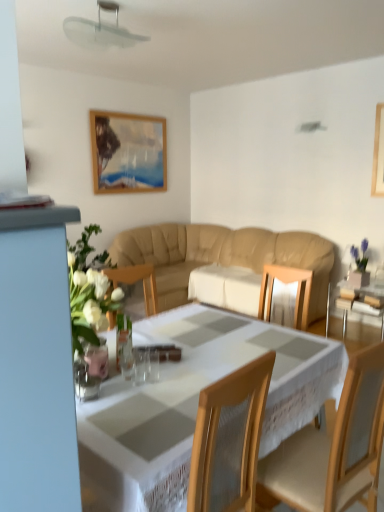
Question: Considering the relative sizes of wooden chair at center and transparent glass table at right in the image provided, is wooden chair at center thinner than transparent glass table at right?

Choices:
 (A) no
 (B) yes

Answer: (B)

Question: Can you confirm if wooden chair at center is smaller than transparent glass table at right?

Choices:
 (A) no
 (B) yes

Answer: (A)

Question: Considering the relative sizes of wooden chair at center and transparent glass table at right in the image provided, is wooden chair at center shorter than transparent glass table at right?

Choices:
 (A) no
 (B) yes

Answer: (A)

Question: Would you consider wooden chair at center to be distant from transparent glass table at right?

Choices:
 (A) yes
 (B) no

Answer: (A)

Question: Does wooden chair at center lie in front of transparent glass table at right?

Choices:
 (A) yes
 (B) no

Answer: (A)

Question: From a real-world perspective, is clear glass vase at lower left physically located above or below transparent plastic fan at upper center?

Choices:
 (A) above
 (B) below

Answer: (B)

Question: From the image's perspective, is clear glass vase at lower left positioned above or below transparent plastic fan at upper center?

Choices:
 (A) below
 (B) above

Answer: (A)

Question: Based on their positions, is clear glass vase at lower left located to the left or right of transparent plastic fan at upper center?

Choices:
 (A) left
 (B) right

Answer: (B)

Question: From their relative heights in the image, would you say clear glass vase at lower left is taller or shorter than transparent plastic fan at upper center?

Choices:
 (A) short
 (B) tall

Answer: (A)

Question: Looking at their shapes, would you say clear glass vase at lower left is wider or thinner than white lace tablecloth at center?

Choices:
 (A) wide
 (B) thin

Answer: (B)

Question: Considering the positions of point (84, 352) and point (109, 459), is point (84, 352) closer or farther from the camera than point (109, 459)?

Choices:
 (A) closer
 (B) farther

Answer: (B)

Question: Based on their positions, is clear glass vase at lower left located to the left or right of white lace tablecloth at center?

Choices:
 (A) right
 (B) left

Answer: (B)

Question: In terms of size, does clear glass vase at lower left appear bigger or smaller than white lace tablecloth at center?

Choices:
 (A) small
 (B) big

Answer: (A)

Question: Considering the positions of point (182, 295) and point (365, 372), is point (182, 295) closer or farther from the camera than point (365, 372)?

Choices:
 (A) farther
 (B) closer

Answer: (A)

Question: From the image's perspective, is beige leather couch at center located above or below wooden chair at center?

Choices:
 (A) above
 (B) below

Answer: (A)